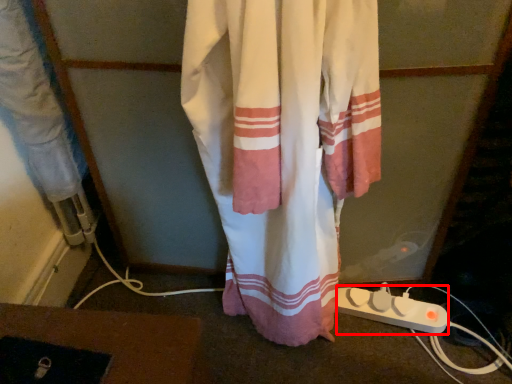
Question: Where is extension cord (annotated by the red box) located in relation to curtain in the image?

Choices:
 (A) left
 (B) right

Answer: (B)